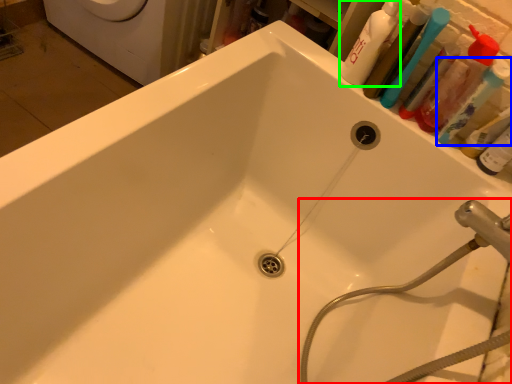
Question: Which is farther away from plumbing fixture (highlighted by a red box)? toothbrush (highlighted by a blue box) or cleaning product (highlighted by a green box)?

Choices:
 (A) toothbrush
 (B) cleaning product

Answer: (B)